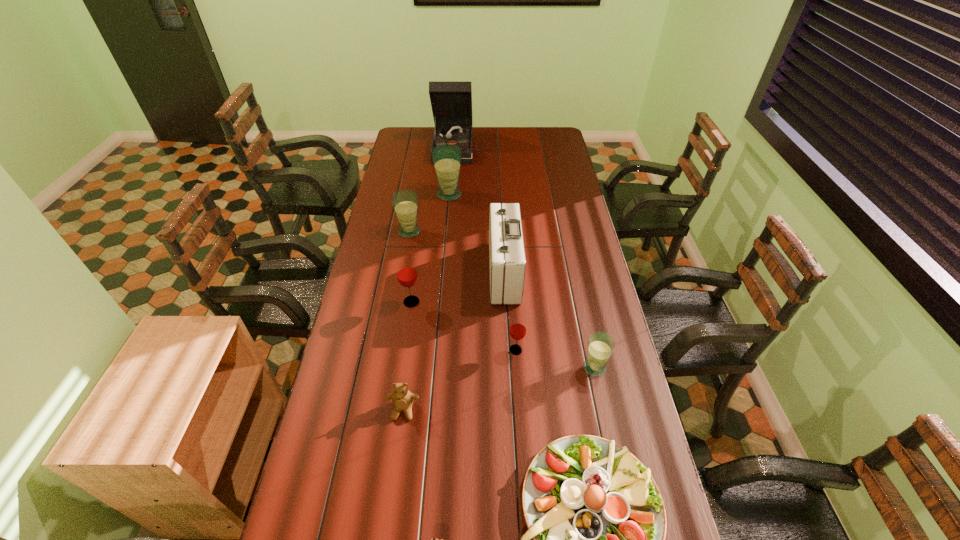
I want to click on vacant space located on the front of the third farthest object, so (401, 277).

The height and width of the screenshot is (540, 960). Identify the location of vacant space situated on the left of the nearest glass. (540, 368).

Where is `free space located 0.090m on the front of the smaller red glass`? The width and height of the screenshot is (960, 540). free space located 0.090m on the front of the smaller red glass is located at coordinates (518, 381).

The width and height of the screenshot is (960, 540). Identify the location of vacant point located on the front-facing side of the third nearest object. (398, 446).

Image resolution: width=960 pixels, height=540 pixels. I want to click on object at the far edge, so click(451, 102).

Find the location of a particular element. object present at the left edge is located at coordinates (405, 201).

I want to click on object that is positioned at the right edge, so click(601, 345).

Find the location of a particular element. The image size is (960, 540). vacant space at the far edge of the desktop is located at coordinates (511, 130).

You are a GUI agent. You are given a task and a screenshot of the screen. Output one action in this format:
    pyautogui.click(x=<x>, y=<y>)
    Task: Click on the vacant space at the left edge of the desktop
    This screenshot has height=540, width=960.
    Given the screenshot: What is the action you would take?
    point(392,200)

Identify the location of free space at the right edge. (565, 173).